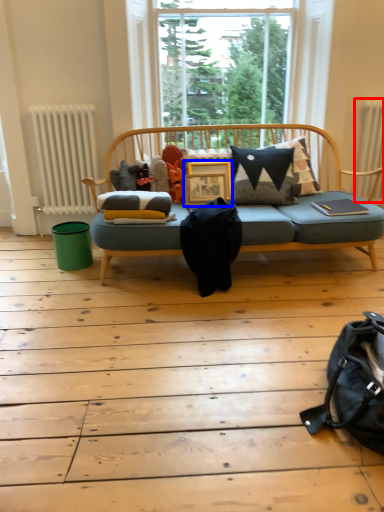
Question: Which object appears closest to the camera in this image, radiator (highlighted by a red box) or table (highlighted by a blue box)?

Choices:
 (A) radiator
 (B) table

Answer: (B)